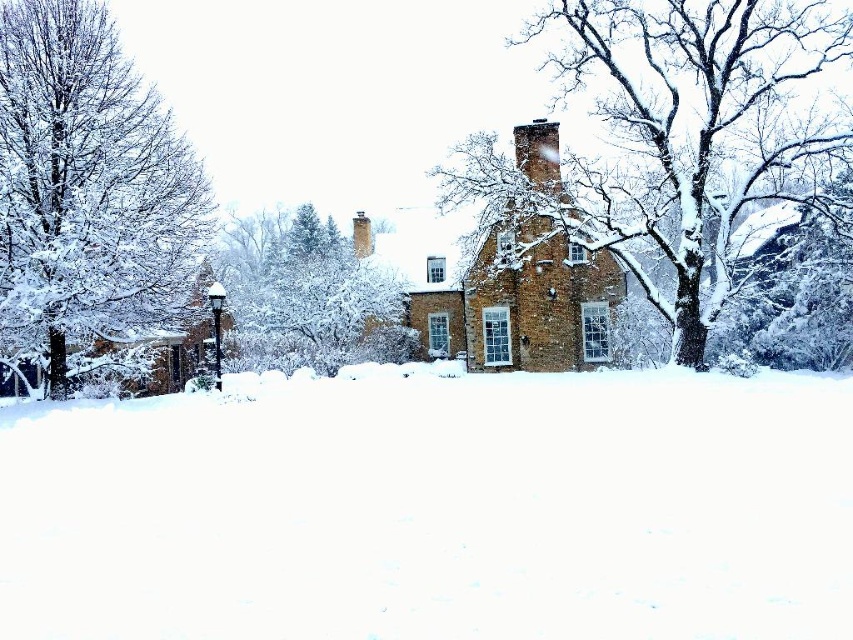
Question: Which object appears farthest from the camera in this image?

Choices:
 (A) snow-covered bark tree at upper right
 (B) white fluffy snow at center
 (C) snow-covered tree at left
 (D) snow-covered evergreen at center

Answer: (D)

Question: Which of the following is the closest to the observer?

Choices:
 (A) brick chimney at center
 (B) white fluffy snow at center

Answer: (B)

Question: Can you confirm if snow-covered tree at left is thinner than snow-covered evergreen at center?

Choices:
 (A) yes
 (B) no

Answer: (A)

Question: Is white fluffy snow at center wider than snow-covered evergreen at center?

Choices:
 (A) yes
 (B) no

Answer: (A)

Question: Which point is farther to the camera?

Choices:
 (A) snow-covered tree at left
 (B) snow-covered bark tree at upper right
 (C) brick chimney at center

Answer: (C)

Question: Is white fluffy snow at center further to the viewer compared to brick chimney at center?

Choices:
 (A) no
 (B) yes

Answer: (A)